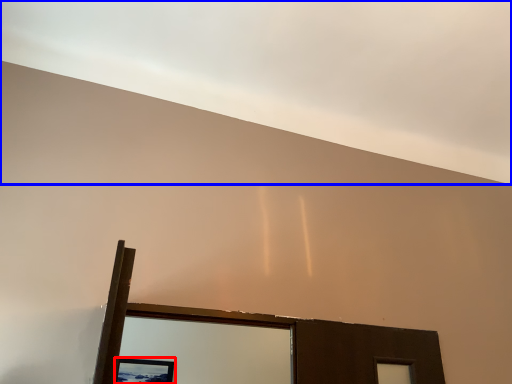
Question: Which point is further to the camera, picture frame (highlighted by a red box) or cloud (highlighted by a blue box)?

Choices:
 (A) picture frame
 (B) cloud

Answer: (A)